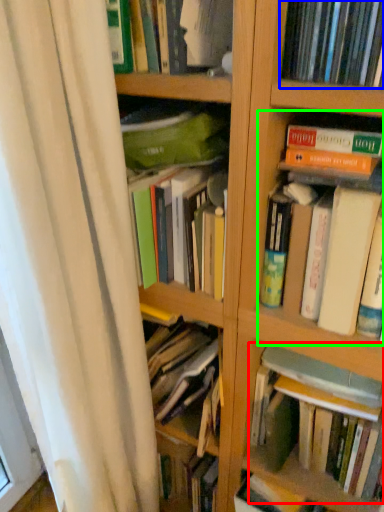
Question: Considering the real-world distances, which object is closest to book (highlighted by a red box)? book (highlighted by a blue box) or book (highlighted by a green box).

Choices:
 (A) book
 (B) book

Answer: (B)